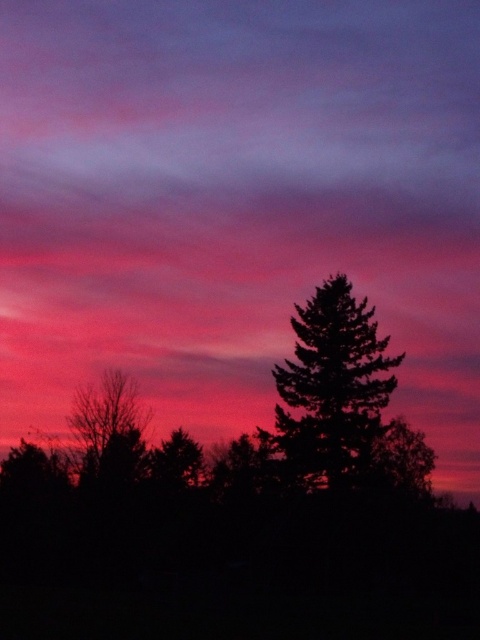
You are an artist sketching the sunset scene. You need to draw the silhouette evergreen tree at center and the bare branches at left. Which one should you draw first to maintain the correct spatial relationship?

You should draw the silhouette evergreen tree at center first because it is above the bare branches at left, so it needs to be placed higher in your sketch.

You are standing in the scene and want to take a photo of the silhouette evergreen tree at center. If your camera can focus on objects up to 150 feet away, will you be able to capture it clearly?

The silhouette evergreen tree at center is 140.17 feet away from the viewer. Since the camera can focus up to 150 feet, you can capture it clearly.